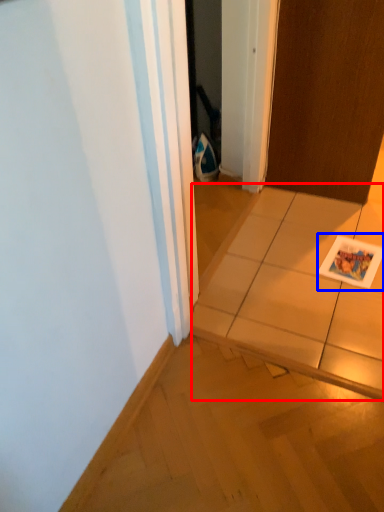
Question: Which point is further to the camera, tile (highlighted by a red box) or postcard (highlighted by a blue box)?

Choices:
 (A) tile
 (B) postcard

Answer: (B)